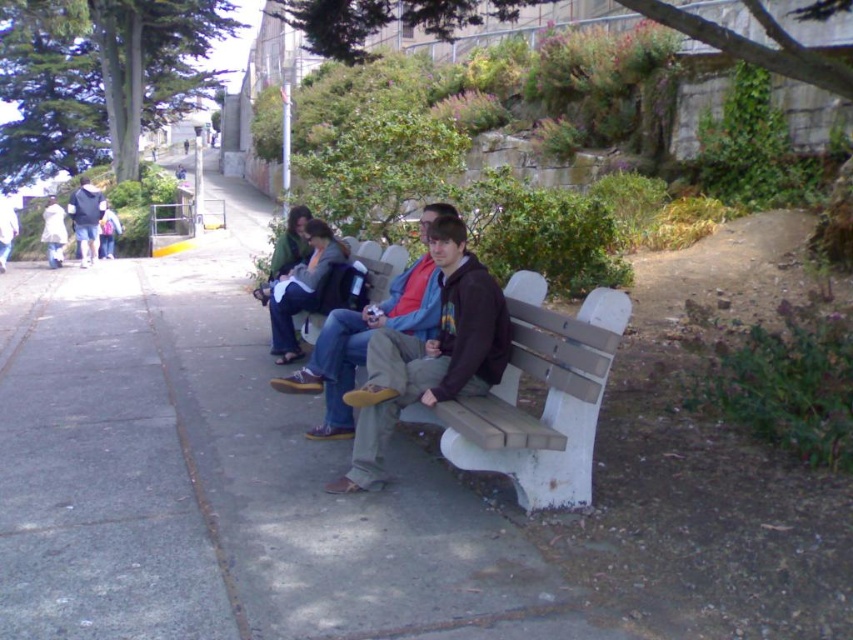
Question: Which object is positioned farthest from the wooden bench at center?

Choices:
 (A) matte black backpack at left
 (B) denim jacket at center
 (C) dark brown leather jacket at center
 (D) matte brown jacket at center

Answer: (A)

Question: Which is farther from the matte black backpack at left?

Choices:
 (A) wooden bench at center
 (B) dark brown leather jacket at center
 (C) white wood bench at center

Answer: (C)

Question: Considering the relative positions of wooden bench at center and matte black backpack at left in the image provided, where is wooden bench at center located with respect to matte black backpack at left?

Choices:
 (A) left
 (B) right

Answer: (B)

Question: Can you confirm if matte brown jacket at center is thinner than dark brown leather jacket at center?

Choices:
 (A) yes
 (B) no

Answer: (A)

Question: Which point is closer to the camera?

Choices:
 (A) wooden bench at center
 (B) matte brown jacket at center
 (C) dark brown leather jacket at center

Answer: (B)

Question: Can you confirm if wooden bench at center is thinner than matte black backpack at left?

Choices:
 (A) no
 (B) yes

Answer: (B)